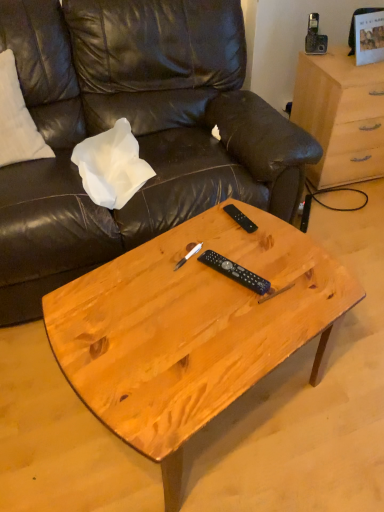
In order to click on free space in front of black plastic remote at center, the 1th remote positioned from the bottom in this screenshot , I will do `click(233, 325)`.